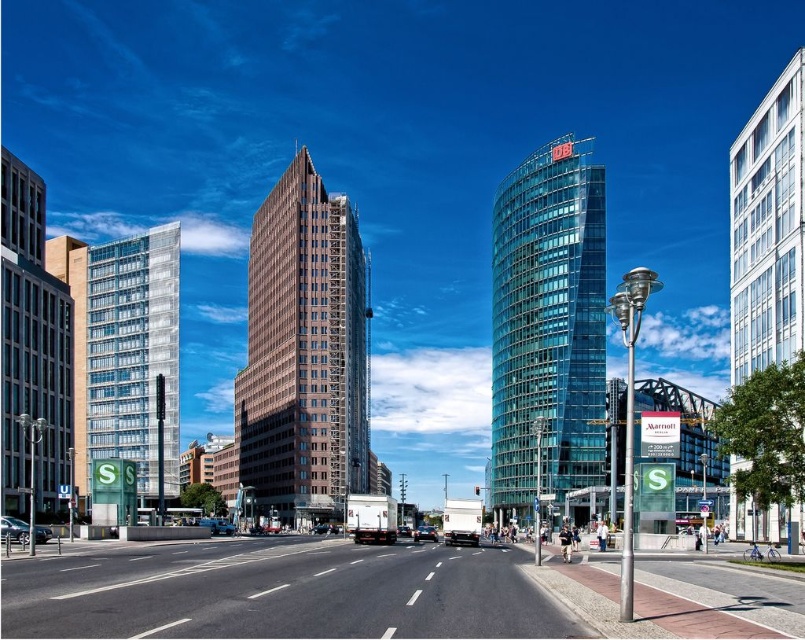
Question: Is white glass building at right above metallic silver car at lower left?

Choices:
 (A) no
 (B) yes

Answer: (B)

Question: Which point is farther to the camera?

Choices:
 (A) (434, 541)
 (B) (409, 531)
 (C) (547, 296)

Answer: (C)

Question: Which is farther from the metallic silver sedan at center?

Choices:
 (A) transparent glass tower at center
 (B) dark gray concrete building at left
 (C) white glass building at right
 (D) metallic silver car at lower left

Answer: (C)

Question: Which point is closer to the camera?

Choices:
 (A) brown brick building at center
 (B) dark gray concrete building at left

Answer: (B)

Question: Does clear glass building at left have a larger size compared to shiny black sedan at center?

Choices:
 (A) yes
 (B) no

Answer: (A)

Question: Is metallic silver car at lower left below metallic silver sedan at center?

Choices:
 (A) no
 (B) yes

Answer: (A)